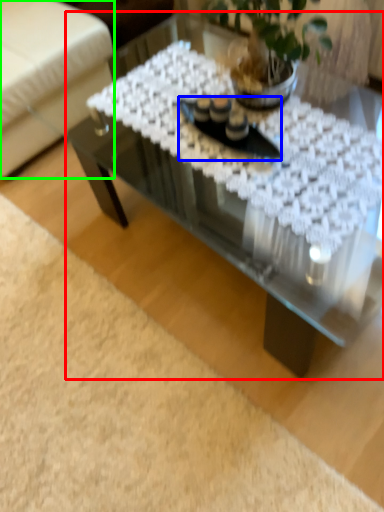
Question: Based on their relative distances, which object is nearer to coffee table (highlighted by a red box)? Choose from glass plate (highlighted by a blue box) and armchair (highlighted by a green box).

Choices:
 (A) glass plate
 (B) armchair

Answer: (A)